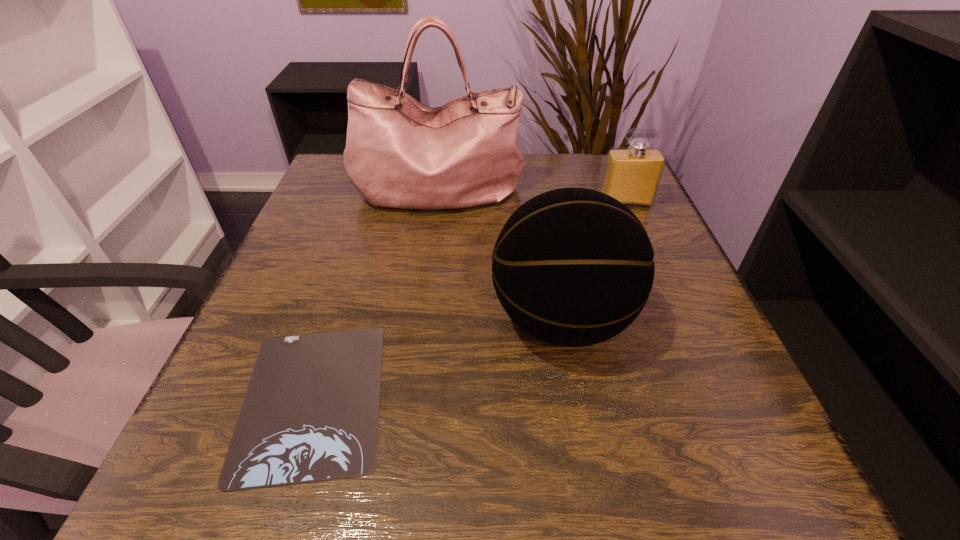
Identify the location of vacant space in between the rightmost object and the shortest object. (468, 300).

At what (x,y) coordinates should I click in order to perform the action: click on vacant area that lies between the tallest object and the shortest object. Please return your answer as a coordinate pair (x, y). The image size is (960, 540). Looking at the image, I should click on (375, 295).

Identify the location of blank region between the tallest object and the perfume. The width and height of the screenshot is (960, 540). (532, 198).

I want to click on vacant region between the shortest object and the rightmost object, so click(468, 300).

In order to click on empty space that is in between the tallest object and the third tallest object in this screenshot , I will do `click(532, 198)`.

I want to click on object that can be found as the closest to the handbag, so click(573, 267).

The height and width of the screenshot is (540, 960). What are the coordinates of `object that can be found as the third closest to the shortest object` in the screenshot? It's located at (632, 175).

This screenshot has height=540, width=960. Find the location of `vacant space that satisfies the following two spatial constraints: 1. at the front of the basketball with handles; 2. on the left side of the handbag`. vacant space that satisfies the following two spatial constraints: 1. at the front of the basketball with handles; 2. on the left side of the handbag is located at coordinates (421, 320).

The width and height of the screenshot is (960, 540). Find the location of `free space in the image that satisfies the following two spatial constraints: 1. on the back side of the shortest object; 2. on the left side of the basketball`. free space in the image that satisfies the following two spatial constraints: 1. on the back side of the shortest object; 2. on the left side of the basketball is located at coordinates pos(337,320).

Locate an element on the screen. The image size is (960, 540). vacant space that satisfies the following two spatial constraints: 1. at the front of the basketball with handles; 2. on the right side of the handbag is located at coordinates (421, 320).